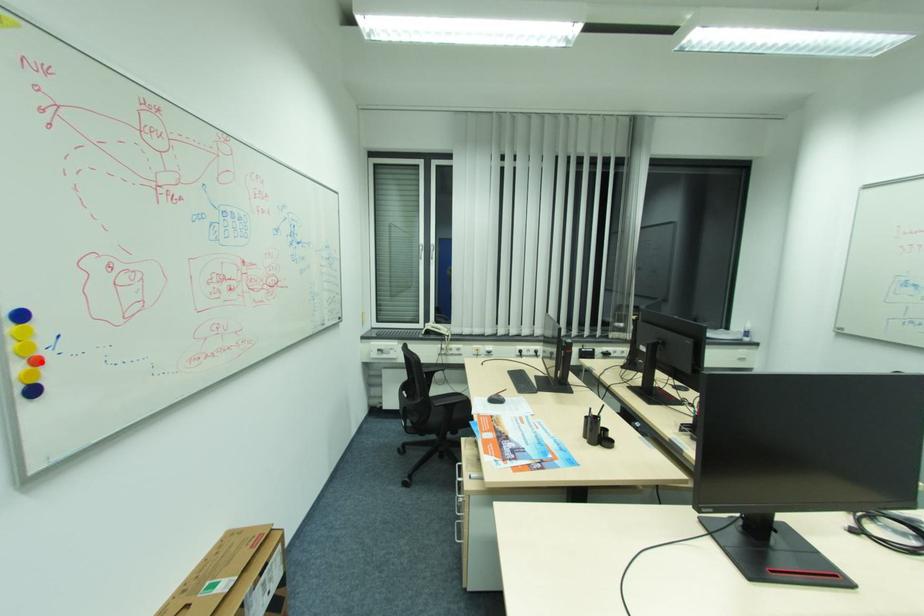
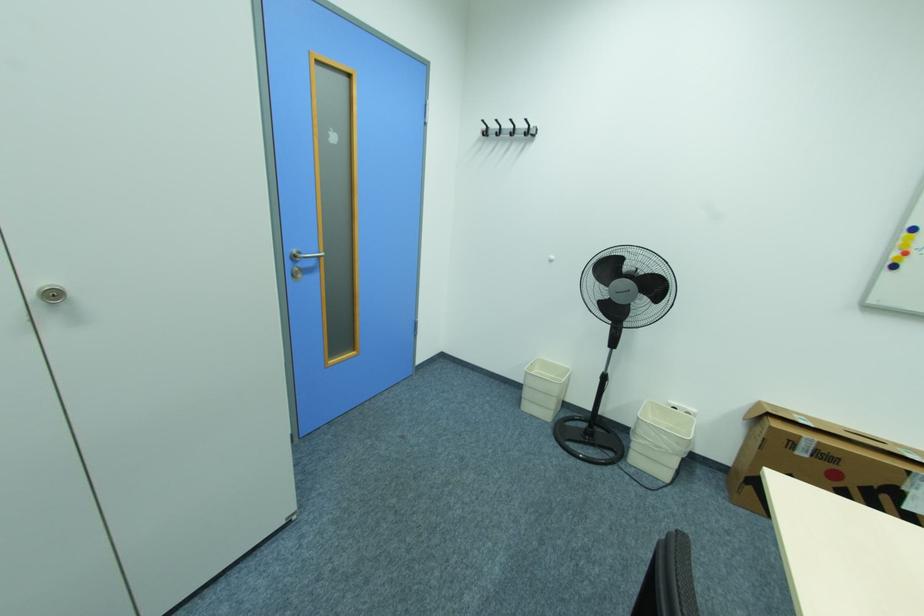
Question: I am providing you with two images of the same scene from different viewpoints. Given a red point in image1, look at the same physical point in image2. Is it:

Choices:
 (A) Closer to the viewpoint
 (B) Farther from the viewpoint

Answer: (B)